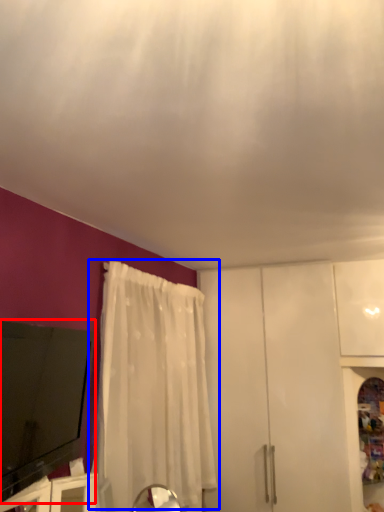
Question: Which point is further to the camera, electronic (highlighted by a red box) or curtain (highlighted by a blue box)?

Choices:
 (A) electronic
 (B) curtain

Answer: (B)